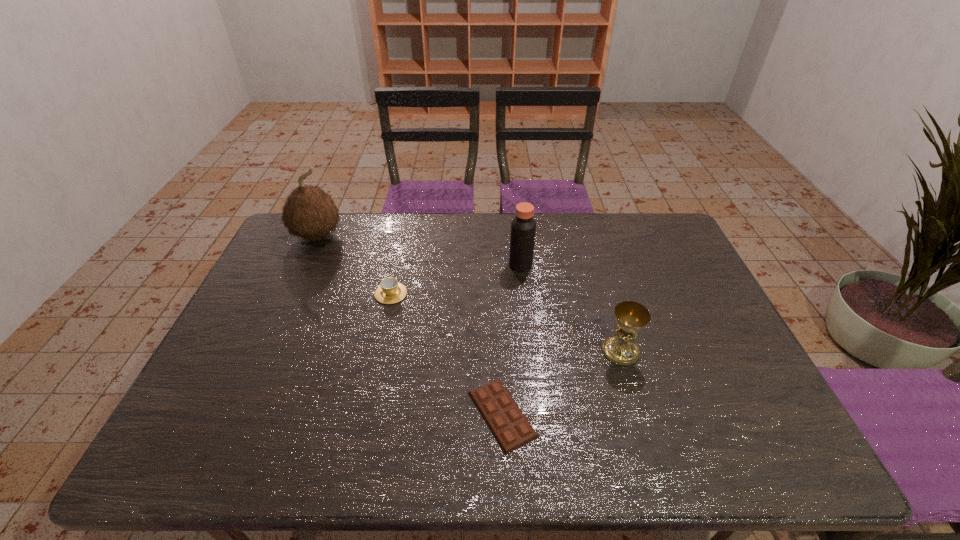
Image resolution: width=960 pixels, height=540 pixels. Identify the location of vacant region that satisfies the following two spatial constraints: 1. on the surface of the vinegar; 2. on the right side of the coconut. (304, 265).